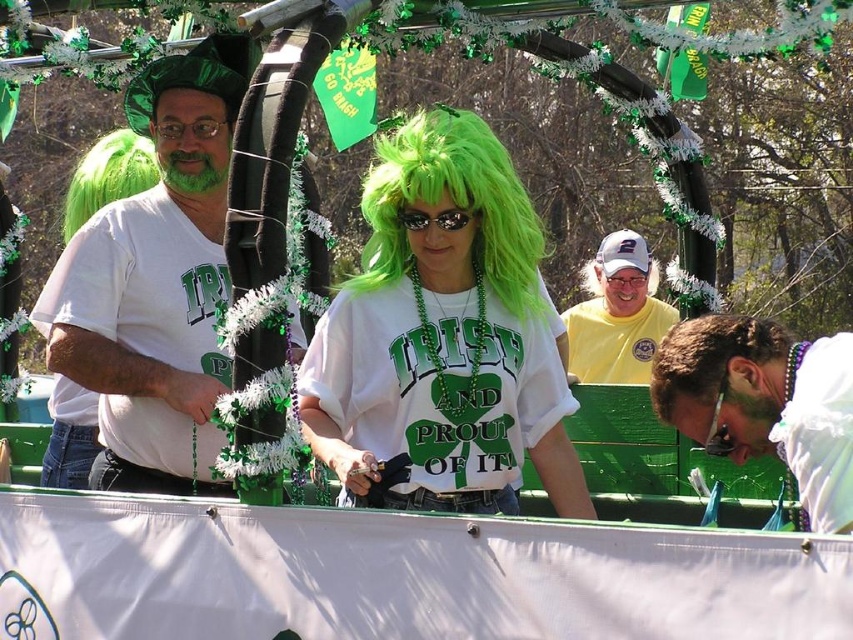
Question: Which object is the farthest from the black plastic sunglasses at center?

Choices:
 (A) green synthetic wig at upper left
 (B) yellow cotton shirt at upper center
 (C) white matte t-shirt at left

Answer: (B)

Question: Does white matte t-shirt at left have a lesser width compared to black plastic sunglasses at center?

Choices:
 (A) yes
 (B) no

Answer: (B)

Question: Is green synthetic wig at upper left bigger than black plastic sunglasses at center?

Choices:
 (A) no
 (B) yes

Answer: (B)

Question: Which point is closer to the camera?

Choices:
 (A) (630, 336)
 (B) (141, 317)

Answer: (B)

Question: Which of these objects is positioned closest to the green synthetic wig at upper left?

Choices:
 (A) white matte t-shirt at left
 (B) yellow cotton shirt at upper center

Answer: (A)

Question: Where is yellow cotton shirt at upper center located in relation to black plastic sunglasses at center in the image?

Choices:
 (A) left
 (B) right

Answer: (B)